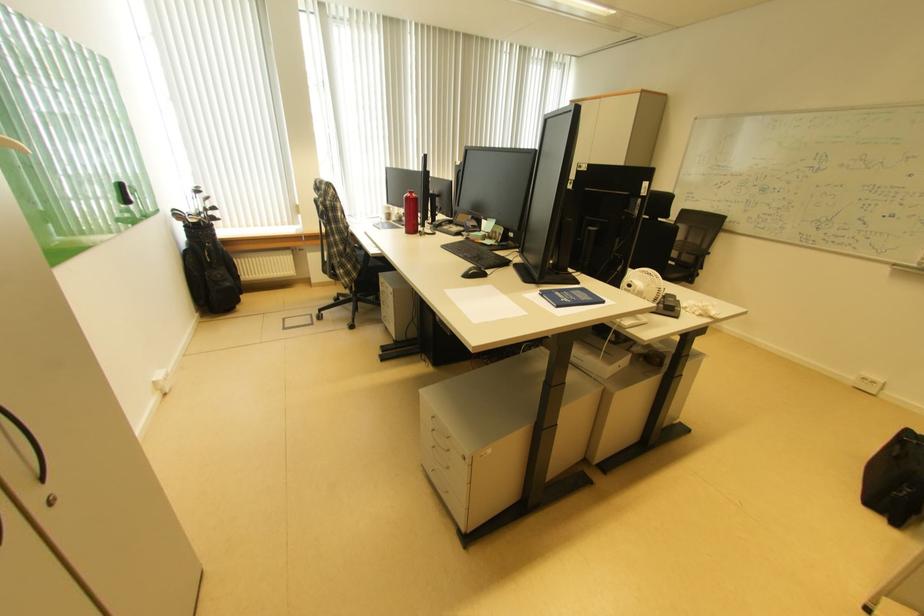
Locate an element on the screen. chair armrest is located at coordinates (698, 254).